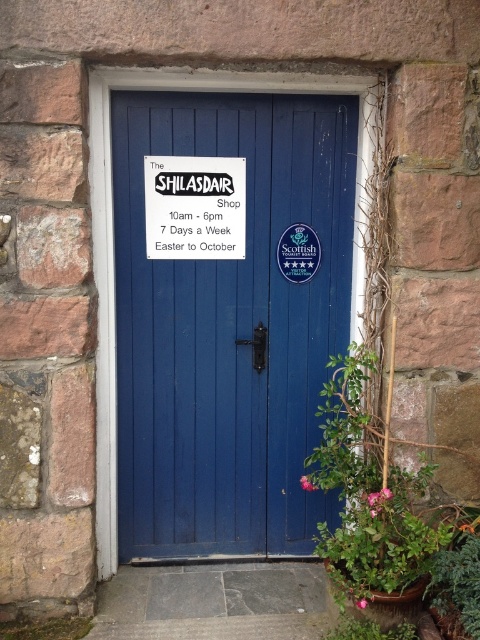
From the picture: Can you confirm if blue wooden door at center is thinner than green leafy plant at lower right?

In fact, blue wooden door at center might be wider than green leafy plant at lower right.

Is blue wooden door at center shorter than green leafy plant at lower right?

No.

Does point (324, 209) lie behind point (469, 573)?

Yes, it is.

The height and width of the screenshot is (640, 480). What are the coordinates of `blue wooden door at center` in the screenshot? It's located at (228, 326).

Is green leafy plant at right in front of green leafy plant at lower right?

No, it is behind green leafy plant at lower right.

Is point (443, 536) positioned before point (441, 582)?

Yes, it is in front of point (441, 582).

Locate an element on the screen. green leafy plant at right is located at coordinates (370, 500).

Does blue wooden door at center come in front of white paper sign at center?

That is True.

Describe the element at coordinates (228, 326) in the screenshot. I see `blue wooden door at center` at that location.

Measure the distance between blue wooden door at center and camera.

The distance of blue wooden door at center from camera is 8.88 feet.

What are the coordinates of `blue wooden door at center` in the screenshot? It's located at (228, 326).